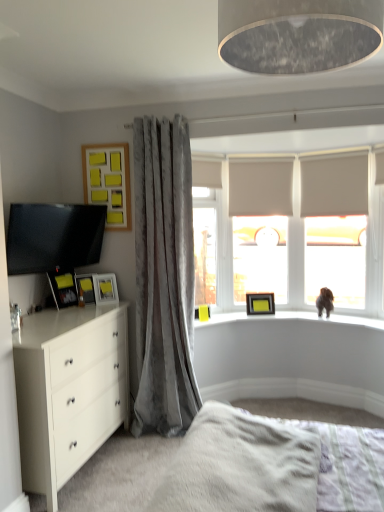
What do you see at coordinates (85, 289) in the screenshot? This screenshot has height=512, width=384. I see `matte yellow picture frame at left, the 4th picture frame viewed from the right` at bounding box center [85, 289].

You are a GUI agent. You are given a task and a screenshot of the screen. Output one action in this format:
    pyautogui.click(x=<x>, y=<y>)
    Task: Click on the white fluffy bed at lower center
    This screenshot has width=384, height=512.
    Given the screenshot: What is the action you would take?
    pyautogui.click(x=272, y=466)

Measure the distance between matte gray lampshade at upper center and camera.

The depth of matte gray lampshade at upper center is 35.08 inches.

Measure the distance between velvet gray curtain at left and camera.

velvet gray curtain at left and camera are 2.90 meters apart.

Where is `matte black tv at left`? matte black tv at left is located at coordinates (53, 237).

Image resolution: width=384 pixels, height=512 pixels. Find the location of `matte yellow picture frame at left, the 2th picture frame positioned from the left`. matte yellow picture frame at left, the 2th picture frame positioned from the left is located at coordinates (85, 289).

Between matte gray lampshade at upper center and matte yellow picture frame at upper center, which is the first picture frame in back-to-front order, which one has less height?

matte yellow picture frame at upper center, which is the first picture frame in back-to-front order, is shorter.

Which object is thinner, matte gray lampshade at upper center or matte yellow picture frame at upper center, the 1th picture frame from the bottom?

With smaller width is matte yellow picture frame at upper center, the 1th picture frame from the bottom.

The image size is (384, 512). Find the location of `light fixture above the matte yellow picture frame at upper center, the fifth picture frame in the top-to-bottom sequence (from the image's perspective)`. light fixture above the matte yellow picture frame at upper center, the fifth picture frame in the top-to-bottom sequence (from the image's perspective) is located at coordinates (298, 34).

From the image's perspective, is matte gray lampshade at upper center positioned above or below matte yellow picture frame at upper center, which is the first picture frame in back-to-front order?

matte gray lampshade at upper center is situated higher than matte yellow picture frame at upper center, which is the first picture frame in back-to-front order, in the image.

From the picture: Is velvet gray curtain at left at the back of yellow matte picture frame at left, positioned as the 4th picture frame in front-to-back order?

No, yellow matte picture frame at left, positioned as the 4th picture frame in front-to-back order, is not facing the opposite direction of velvet gray curtain at left.

From the image's perspective, is yellow matte picture frame at left, the third picture frame in the right-to-left sequence, located above or below velvet gray curtain at left?

Clearly, from the image's perspective, yellow matte picture frame at left, the third picture frame in the right-to-left sequence, is below velvet gray curtain at left.

Considering the relative positions of yellow matte picture frame at left, acting as the 3th picture frame starting from the top, and velvet gray curtain at left in the image provided, is yellow matte picture frame at left, acting as the 3th picture frame starting from the top, to the left or to the right of velvet gray curtain at left?

In the image, yellow matte picture frame at left, acting as the 3th picture frame starting from the top, appears on the left side of velvet gray curtain at left.

From a real-world perspective, which is physically below, velvet gray curtain at left or matte black tv at left?

From a 3D spatial view, velvet gray curtain at left is below.

Between point (162, 357) and point (105, 218), which one is positioned behind?

The point (105, 218) is farther.

Where is `television in front of the velvet gray curtain at left`? Image resolution: width=384 pixels, height=512 pixels. television in front of the velvet gray curtain at left is located at coordinates (53, 237).

Considering the relative sizes of velvet gray curtain at left and matte black tv at left in the image provided, is velvet gray curtain at left taller than matte black tv at left?

Yes, velvet gray curtain at left is taller than matte black tv at left.

Is velvet gray curtain at left far from white glossy chest of drawers at lower left?

No, velvet gray curtain at left is not far from white glossy chest of drawers at lower left.

Which point is more forward, (152, 280) or (28, 480)?

The point (28, 480) is more forward.

From a real-world perspective, who is located higher, velvet gray curtain at left or white glossy chest of drawers at lower left?

In real-world perspective, velvet gray curtain at left is above.

Is velvet gray curtain at left positioned with its back to white fluffy bed at lower center?

No.

At what (x,y) coordinates should I click in order to perform the action: click on curtain on the left of white fluffy bed at lower center. Please return your answer as a coordinate pair (x, y). The image size is (384, 512). Looking at the image, I should click on (164, 277).

Between velvet gray curtain at left and white fluffy bed at lower center, which one appears on the left side from the viewer's perspective?

velvet gray curtain at left is more to the left.

Does velvet gray curtain at left lie behind white fluffy bed at lower center?

That is True.

Can you confirm if matte gray lampshade at upper center is smaller than matte black picture frame at left, the 5th picture frame viewed from the right?

No, matte gray lampshade at upper center is not smaller than matte black picture frame at left, the 5th picture frame viewed from the right.

Is matte black picture frame at left, which appears as the fifth picture frame when viewed from the back, surrounded by matte gray lampshade at upper center?

No, matte gray lampshade at upper center does not contain matte black picture frame at left, which appears as the fifth picture frame when viewed from the back.

Who is taller, matte gray lampshade at upper center or matte black picture frame at left, which appears as the fifth picture frame when viewed from the back?

matte black picture frame at left, which appears as the fifth picture frame when viewed from the back.

From a real-world perspective, which object stands above the other?

matte gray lampshade at upper center.

Would you say matte yellow picture frame at left, which is the fourth picture frame in top-to-bottom order, contains matte gray lampshade at upper center?

No.

From the image's perspective, between matte yellow picture frame at left, which is the fourth picture frame in top-to-bottom order, and matte gray lampshade at upper center, which one is located above?

From the image's view, matte gray lampshade at upper center is above.

Locate an element on the screen. the 4th picture frame below the matte gray lampshade at upper center (from a real-world perspective) is located at coordinates (85, 289).

Is matte yellow picture frame at left, positioned as the 2th picture frame in bottom-to-top order, beside matte gray lampshade at upper center?

They are not placed beside each other.

Locate an element on the screen. This screenshot has height=512, width=384. light fixture that appears above the matte yellow picture frame at upper center, acting as the 1th picture frame starting from the right (from a real-world perspective) is located at coordinates (298, 34).

Starting from the velvet gray curtain at left, which picture frame is the 4th one behind? Please provide its 2D coordinates.

[(105, 288)]

Looking at the image, which one is located further to matte yellow picture frame at left, positioned as the 2th picture frame in bottom-to-top order, wooden frame with yellow sticky notes at upper left, which ranks as the second picture frame in right-to-left order, or translucent glass window screen at center?

The object further to matte yellow picture frame at left, positioned as the 2th picture frame in bottom-to-top order, is translucent glass window screen at center.

Estimate the real-world distances between objects in this image. Which object is further from yellow matte picture frame at left, acting as the 3th picture frame starting from the top, matte black tv at left or matte black picture frame at left, which ranks as the first picture frame in front-to-back order?

matte black tv at left.

Estimate the real-world distances between objects in this image. Which object is closer to yellow matte picture frame at left, the third picture frame in the right-to-left sequence, white fluffy bed at lower center or velvet gray curtain at left?

Based on the image, velvet gray curtain at left appears to be nearer to yellow matte picture frame at left, the third picture frame in the right-to-left sequence.

Which object lies nearer to the anchor point matte black picture frame at left, the 5th picture frame viewed from the right, matte gray lampshade at upper center or yellow matte picture frame at left, acting as the 2th picture frame starting from the back?

yellow matte picture frame at left, acting as the 2th picture frame starting from the back, is positioned closer to the anchor matte black picture frame at left, the 5th picture frame viewed from the right.

Which object lies further to the anchor point matte yellow picture frame at upper center, which is the 5th picture frame from front to back, yellow matte picture frame at left, the third picture frame in the right-to-left sequence, or translucent glass window screen at center?

yellow matte picture frame at left, the third picture frame in the right-to-left sequence, is further to matte yellow picture frame at upper center, which is the 5th picture frame from front to back.

Which object lies nearer to the anchor point matte black picture frame at left, which appears as the fifth picture frame when viewed from the back, matte gray lampshade at upper center or translucent glass window screen at center?

translucent glass window screen at center is positioned closer to the anchor matte black picture frame at left, which appears as the fifth picture frame when viewed from the back.

Which object lies nearer to the anchor point matte black tv at left, translucent glass window screen at center or yellow matte picture frame at left, acting as the 3th picture frame starting from the top?

yellow matte picture frame at left, acting as the 3th picture frame starting from the top, is positioned closer to the anchor matte black tv at left.

Which object lies further to the anchor point velvet gray curtain at left, white glossy chest of drawers at lower left or matte yellow picture frame at upper center, which is the 5th picture frame from front to back?

The object further to velvet gray curtain at left is matte yellow picture frame at upper center, which is the 5th picture frame from front to back.

You are a GUI agent. You are given a task and a screenshot of the screen. Output one action in this format:
    pyautogui.click(x=<x>, y=<y>)
    Task: Click on the picture frame between yellow matte picture frame at left, acting as the 3th picture frame starting from the top, and translucent glass window screen at center from left to right
    Image resolution: width=384 pixels, height=512 pixels.
    Given the screenshot: What is the action you would take?
    pyautogui.click(x=108, y=182)

The width and height of the screenshot is (384, 512). In order to click on bed frame between matte gray lampshade at upper center and matte black picture frame at left, which ranks as the first picture frame in front-to-back order, along the z-axis in this screenshot , I will do `click(272, 466)`.

At what (x,y) coordinates should I click in order to perform the action: click on chest of drawers between matte black tv at left and matte yellow picture frame at upper center, the 1th picture frame from the bottom, from left to right. Please return your answer as a coordinate pair (x, y). This screenshot has height=512, width=384. Looking at the image, I should click on (69, 391).

At what (x,y) coordinates should I click in order to perform the action: click on the chest of drawers located between white fluffy bed at lower center and matte black picture frame at left, the 5th picture frame viewed from the right, in the depth direction. Please return your answer as a coordinate pair (x, y). Looking at the image, I should click on (69, 391).